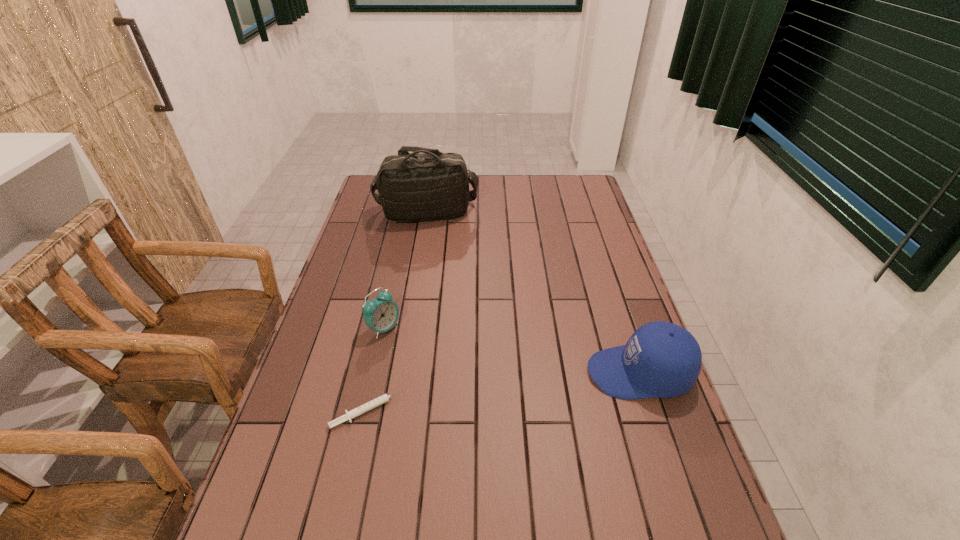
Where is `the shortest object`? The height and width of the screenshot is (540, 960). the shortest object is located at coordinates (374, 403).

Locate an element on the screen. Image resolution: width=960 pixels, height=540 pixels. cap is located at coordinates (661, 359).

Image resolution: width=960 pixels, height=540 pixels. I want to click on the third nearest object, so click(x=381, y=314).

Identify the location of the farthest object. The width and height of the screenshot is (960, 540). 426,185.

Locate an element on the screen. the tallest object is located at coordinates (426, 185).

Locate an element on the screen. This screenshot has height=540, width=960. vacant region located on the back of the shortest object is located at coordinates (379, 364).

Locate an element on the screen. free space located on the front-facing side of the rightmost object is located at coordinates (502, 373).

Find the location of a particular element. The width and height of the screenshot is (960, 540). free space located 0.050m on the front-facing side of the rightmost object is located at coordinates (568, 373).

Identify the location of free spot located on the front-facing side of the rightmost object. (455, 373).

Locate an element on the screen. Image resolution: width=960 pixels, height=540 pixels. blank space located 0.230m on the face of the third nearest object is located at coordinates (468, 367).